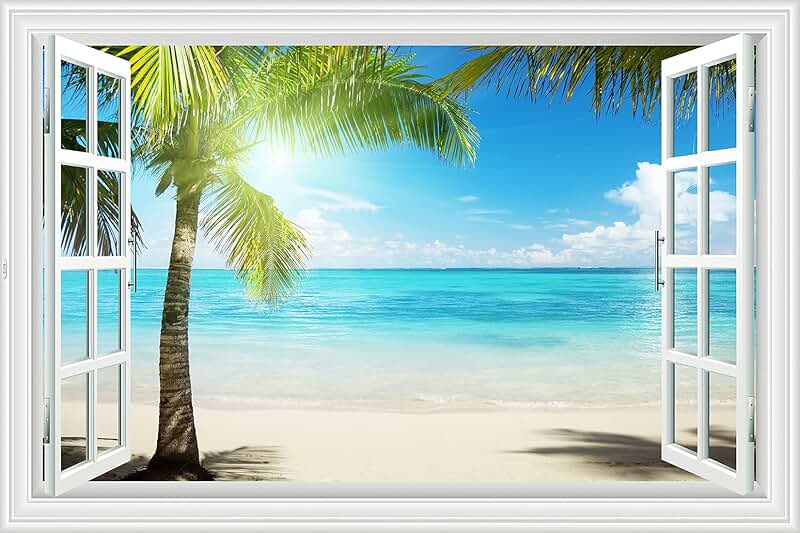
You are a GUI agent. You are given a task and a screenshot of the screen. Output one action in this format:
    pyautogui.click(x=<x>, y=<y>)
    Task: Click on the door
    
    Given the screenshot: What is the action you would take?
    pyautogui.click(x=52, y=196), pyautogui.click(x=740, y=244)